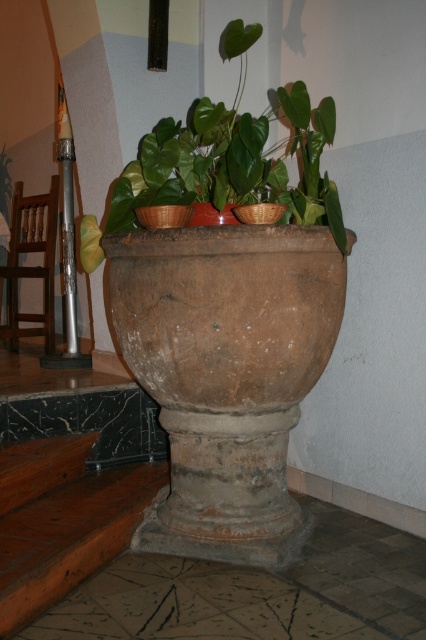
Question: Which point is closer to the camera taking this photo?

Choices:
 (A) (215, 512)
 (B) (158, 136)

Answer: (B)

Question: Does brown earthenware vase at center have a lesser width compared to brown textured pot at center?

Choices:
 (A) no
 (B) yes

Answer: (B)

Question: Can you confirm if brown earthenware vase at center is bigger than brown textured pot at center?

Choices:
 (A) yes
 (B) no

Answer: (B)

Question: Can you confirm if brown earthenware vase at center is positioned to the left of brown textured pot at center?

Choices:
 (A) no
 (B) yes

Answer: (B)